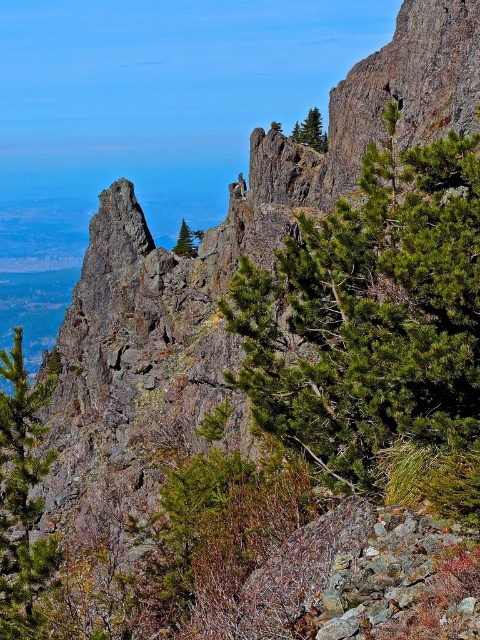
You are a hiker navigating the rugged mountainous landscape. You notice two points marked on your map at coordinates point (x=184, y=232) and point (x=276, y=129). Which of these points is farther away from your current position?

Point (x=184, y=232) is behind point (x=276, y=129), so it is farther away from your current position.